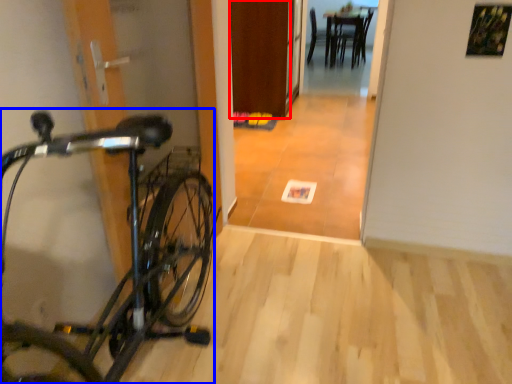
Question: Which point is closer to the camera, door (highlighted by a red box) or bicycle (highlighted by a blue box)?

Choices:
 (A) door
 (B) bicycle

Answer: (B)